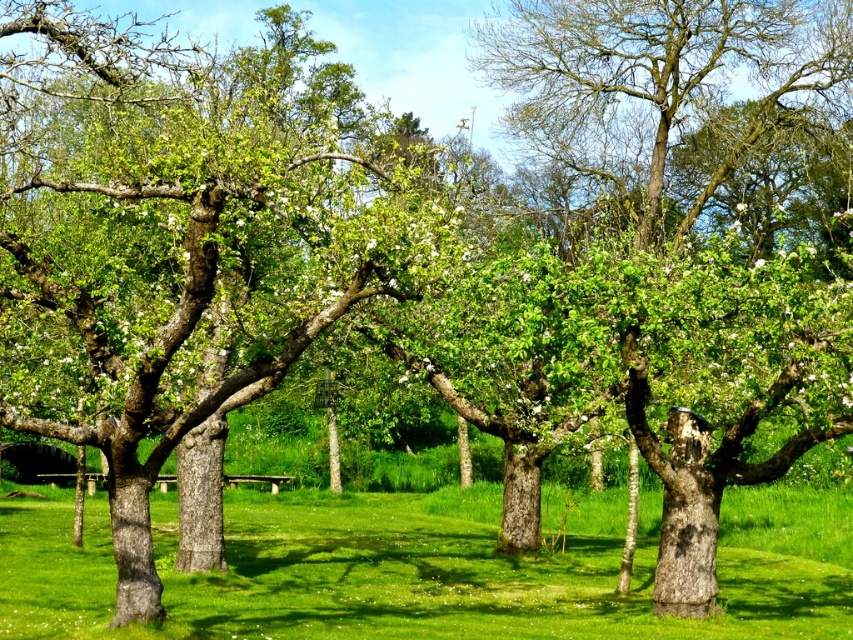
Who is shorter, green rough bark tree at center or green grass at center?

green grass at center is shorter.

Who is more distant from viewer, (416, 145) or (460, 598)?

Point (416, 145)

Find the location of a particular element. The image size is (853, 640). green rough bark tree at center is located at coordinates (184, 237).